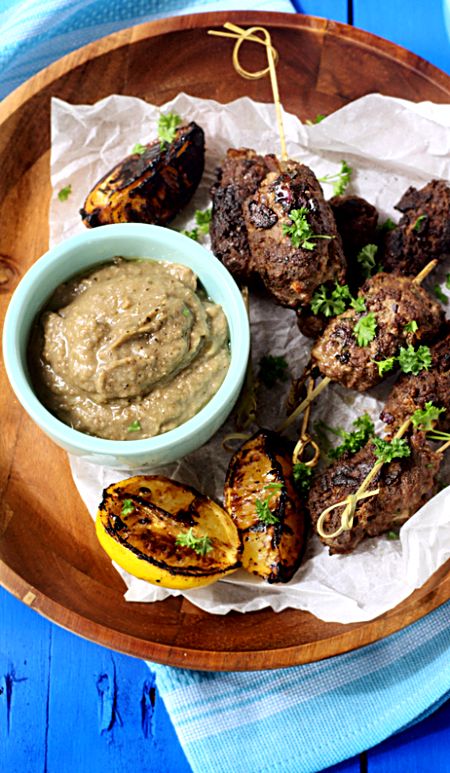
This screenshot has height=773, width=450. Identify the location of brown bowl. (47, 530).